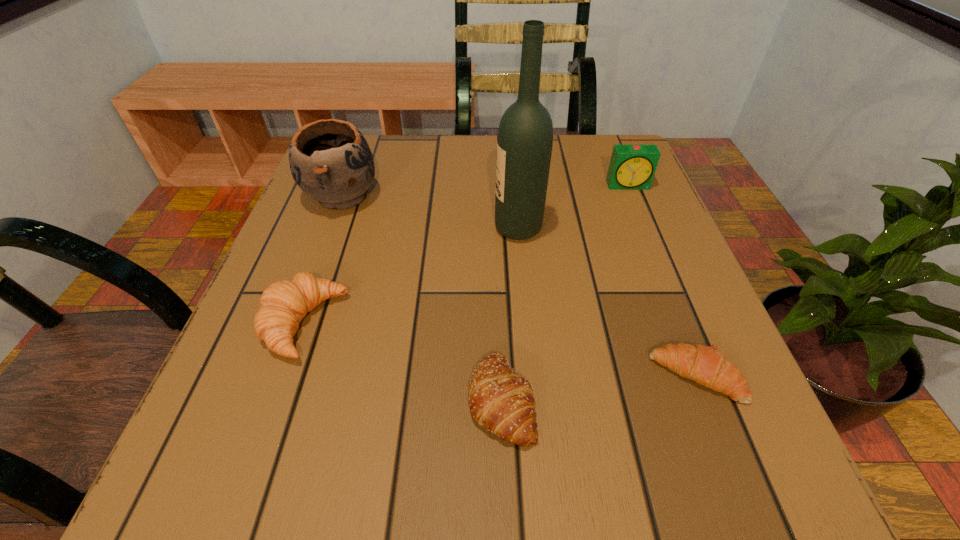
Where is `vacant point located between the pottery and the tallest object`? vacant point located between the pottery and the tallest object is located at coordinates (430, 212).

Locate an element on the screen. empty location between the shortest crescent roll and the third tallest object is located at coordinates [662, 281].

The image size is (960, 540). Find the location of `vacant area between the tallest object and the alarm clock`. vacant area between the tallest object and the alarm clock is located at coordinates (x=573, y=207).

This screenshot has height=540, width=960. I want to click on free space between the shortest object and the pottery, so click(519, 286).

Find the location of a particular element. free spot between the leftmost crescent roll and the third tallest object is located at coordinates (467, 254).

The image size is (960, 540). Identify the location of free spot between the second crescent roll from left to right and the pottery. (x=421, y=298).

Where is `free space that is in between the fourth shortest object and the second tallest object`? free space that is in between the fourth shortest object and the second tallest object is located at coordinates point(485,191).

The width and height of the screenshot is (960, 540). What are the coordinates of `vacant space that's between the shortest object and the wine bottle` in the screenshot? It's located at coord(608,302).

Identify the location of vacant point located between the second crescent roll from left to right and the tallest object. This screenshot has height=540, width=960. (510, 314).

Identify the location of vacant space that's between the shortest crescent roll and the leftmost crescent roll. Image resolution: width=960 pixels, height=540 pixels. (500, 350).